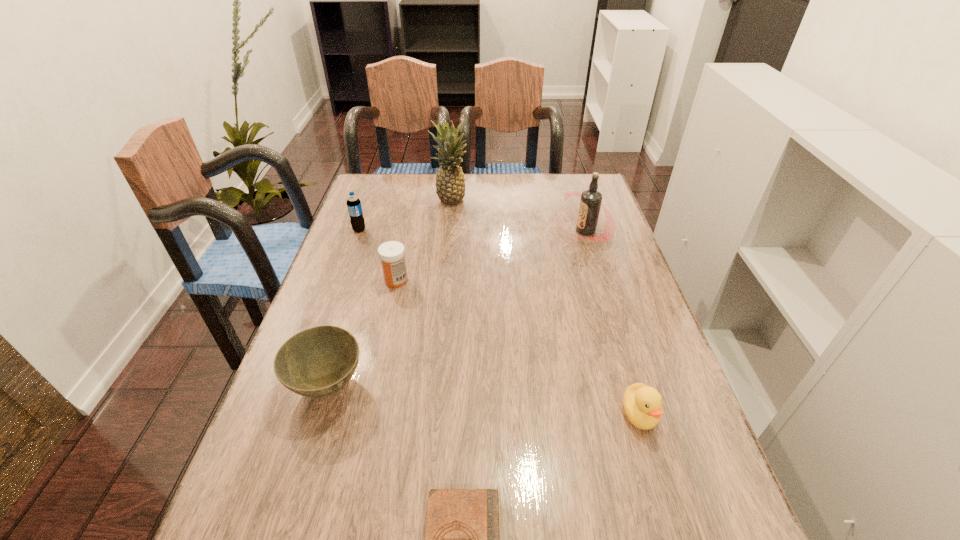
Locate an element on the screen. This screenshot has height=540, width=960. the farthest object is located at coordinates (450, 183).

Find the location of `the tallest object`. the tallest object is located at coordinates (450, 183).

At what (x,y) coordinates should I click in order to perform the action: click on the second tallest object. Please return your answer as a coordinate pair (x, y). Looking at the image, I should click on (591, 200).

Find the location of a particular element. Image resolution: width=960 pixels, height=540 pixels. the fifth shortest object is located at coordinates (354, 206).

Locate an element on the screen. The width and height of the screenshot is (960, 540). medicine is located at coordinates (391, 253).

Image resolution: width=960 pixels, height=540 pixels. What are the coordinates of `bowl` in the screenshot? It's located at (317, 362).

The height and width of the screenshot is (540, 960). I want to click on duckling, so click(x=642, y=404).

Image resolution: width=960 pixels, height=540 pixels. Identify the location of vacant space located 0.050m on the front of the pineapple. (449, 219).

Where is `vacant space located on the label of the sixth shortest object`? The height and width of the screenshot is (540, 960). vacant space located on the label of the sixth shortest object is located at coordinates (453, 231).

The image size is (960, 540). I want to click on free space located 0.170m on the label of the sixth shortest object, so click(504, 231).